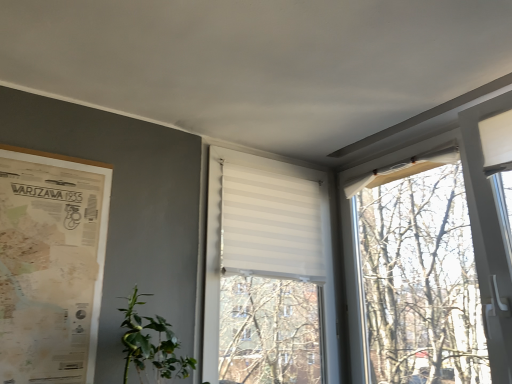
Question: From the image's perspective, is vintage paper map at left located beneath white striped blind at center?

Choices:
 (A) no
 (B) yes

Answer: (A)

Question: Is the depth of vintage paper map at left greater than that of white striped blind at center?

Choices:
 (A) yes
 (B) no

Answer: (B)

Question: Does vintage paper map at left have a greater height compared to white striped blind at center?

Choices:
 (A) no
 (B) yes

Answer: (A)

Question: Is vintage paper map at left shorter than white striped blind at center?

Choices:
 (A) yes
 (B) no

Answer: (A)

Question: Are vintage paper map at left and white striped blind at center far apart?

Choices:
 (A) no
 (B) yes

Answer: (A)

Question: Does vintage paper map at left contain white striped blind at center?

Choices:
 (A) yes
 (B) no

Answer: (B)

Question: Is green leafy plant at lower left further to the viewer compared to white striped blind at center?

Choices:
 (A) no
 (B) yes

Answer: (A)

Question: Does green leafy plant at lower left contain white striped blind at center?

Choices:
 (A) yes
 (B) no

Answer: (B)

Question: Is green leafy plant at lower left closer to camera compared to white striped blind at center?

Choices:
 (A) no
 (B) yes

Answer: (B)

Question: Can you confirm if green leafy plant at lower left is taller than white striped blind at center?

Choices:
 (A) yes
 (B) no

Answer: (B)

Question: Considering the relative sizes of green leafy plant at lower left and white striped blind at center in the image provided, is green leafy plant at lower left bigger than white striped blind at center?

Choices:
 (A) yes
 (B) no

Answer: (B)

Question: From the image's perspective, is green leafy plant at lower left located beneath white striped blind at center?

Choices:
 (A) no
 (B) yes

Answer: (B)

Question: Is green leafy plant at lower left located within vintage paper map at left?

Choices:
 (A) yes
 (B) no

Answer: (B)